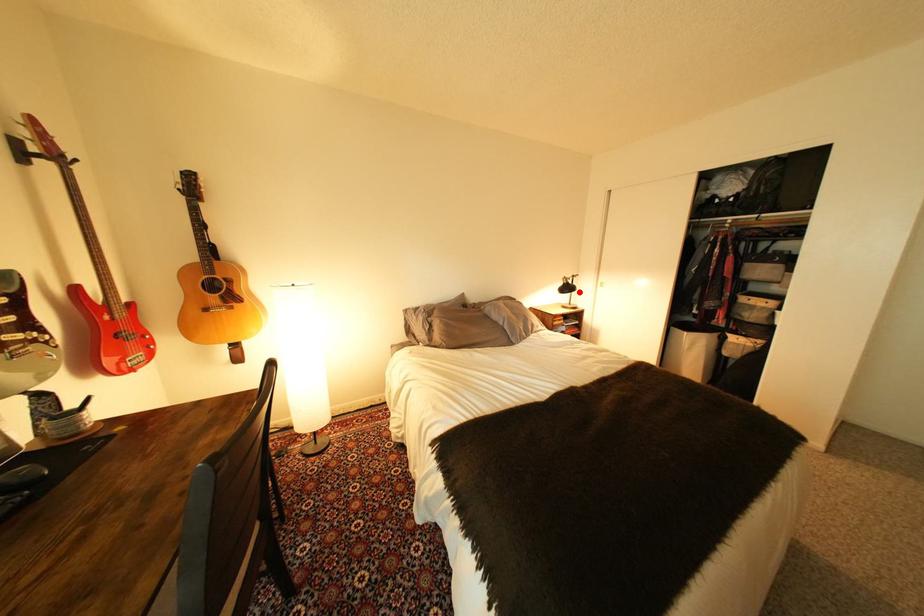
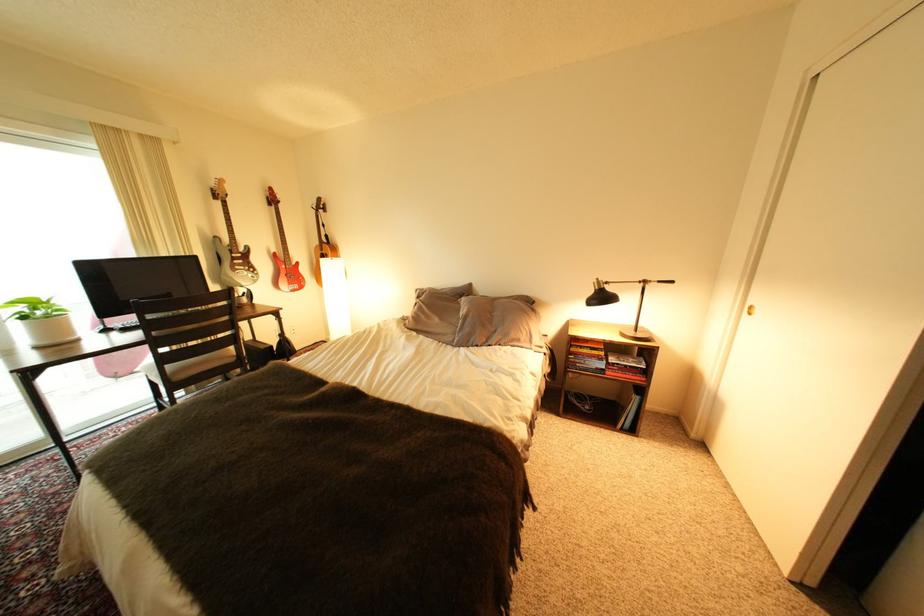
In the second image, find the point that corresponds to the highlighted location in the first image.

(608, 304)